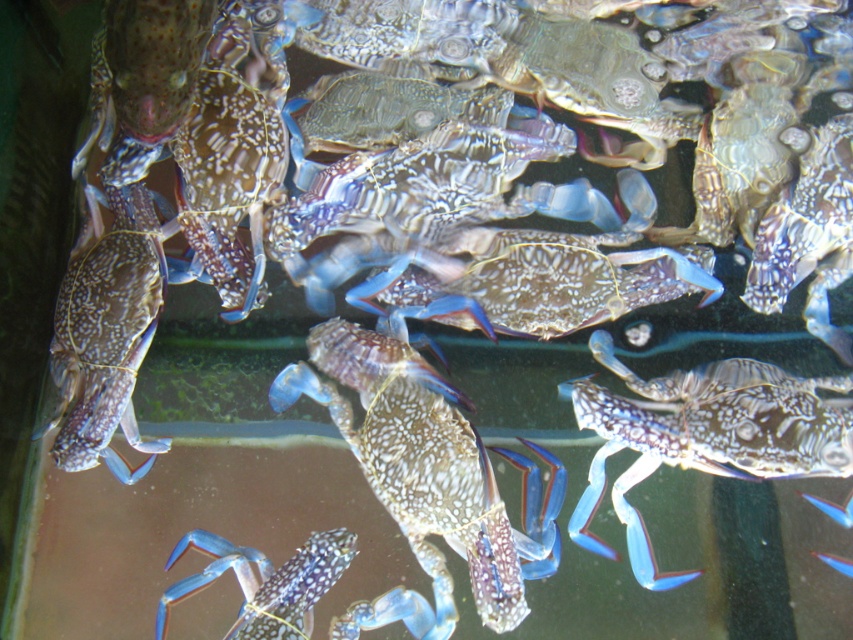
Is speckled blue crab at left positioned behind shiny blue crab at bottom left?

That is True.

In the scene shown: Which is above, speckled blue crab at left or shiny blue crab at bottom left?

speckled blue crab at left is above.

Is point (70, 352) in front of point (250, 637)?

No.

Locate an element on the screen. Image resolution: width=853 pixels, height=640 pixels. speckled blue crab at left is located at coordinates (107, 330).

Which is behind, point (474, 528) or point (71, 292)?

The point (71, 292) is more distant.

Does point (381, 436) come farther from viewer compared to point (135, 216)?

No, (381, 436) is in front of (135, 216).

Who is more forward, (386, 400) or (103, 390)?

Point (103, 390)

The image size is (853, 640). Identify the location of speckled shell crab at center. (418, 461).

Who is more distant from viewer, [593,412] or [131,444]?

The point [593,412] is more distant.

Who is higher up, blue speckled crab at center or speckled blue crab at left?

speckled blue crab at left

Is point (572, 392) farther from viewer compared to point (117, 328)?

Yes, it is behind point (117, 328).

Locate an element on the screen. The height and width of the screenshot is (640, 853). blue speckled crab at center is located at coordinates (703, 435).